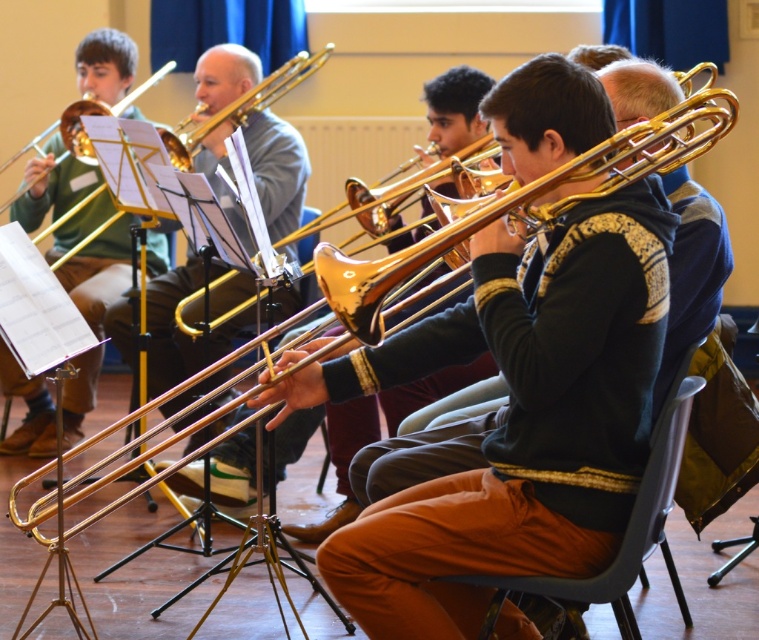
Question: Which object appears closest to the camera in this image?

Choices:
 (A) plastic chair at lower center
 (B) gold brass trumpet at upper left
 (C) gold brass trombone at center

Answer: (A)

Question: From the image, what is the correct spatial relationship of gold shiny trumpet at center in relation to gold brass trumpet at center?

Choices:
 (A) below
 (B) above

Answer: (A)

Question: Where is gold brass trombone at center located in relation to plastic chair at lower center in the image?

Choices:
 (A) right
 (B) left

Answer: (B)

Question: Considering the relative positions of matte gold trombone at left and gold brass trumpet at center in the image provided, where is matte gold trombone at left located with respect to gold brass trumpet at center?

Choices:
 (A) right
 (B) left

Answer: (B)

Question: Which point is closer to the camera?

Choices:
 (A) (124, 77)
 (B) (250, 164)
 (C) (455, 214)
 (D) (63, 112)

Answer: (C)

Question: Estimate the real-world distances between objects in this image. Which object is closer to the gold brass trombone at center?

Choices:
 (A) matte gold trombone at left
 (B) gold brass trumpet at center

Answer: (A)